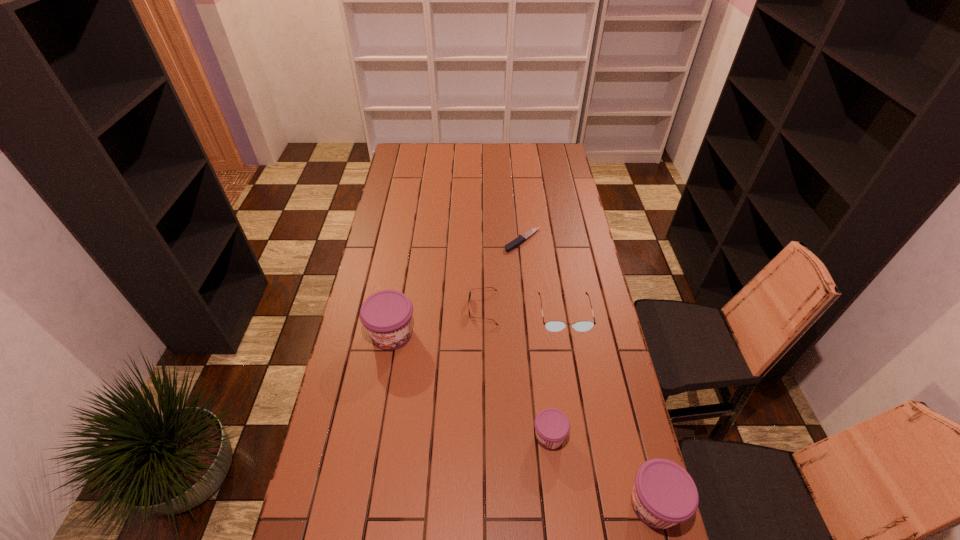
Find the location of a particular element. This screenshot has width=960, height=540. the farthest jam is located at coordinates (387, 315).

In order to click on the leftmost jam in this screenshot , I will do `click(387, 315)`.

I want to click on the fifth farthest object, so click(x=552, y=426).

Where is `the second nearest jam`? The height and width of the screenshot is (540, 960). the second nearest jam is located at coordinates (552, 426).

Image resolution: width=960 pixels, height=540 pixels. In order to click on the second tallest object in this screenshot , I will do `click(664, 494)`.

Find the location of `the nearest jam`. the nearest jam is located at coordinates (664, 494).

The width and height of the screenshot is (960, 540). In order to click on spectacles in this screenshot , I will do (554, 326).

In order to click on the farthest object in this screenshot , I will do point(519,240).

Where is `steak knife`? The image size is (960, 540). steak knife is located at coordinates (519, 240).

Identify the location of the fifth tallest object. (486, 287).